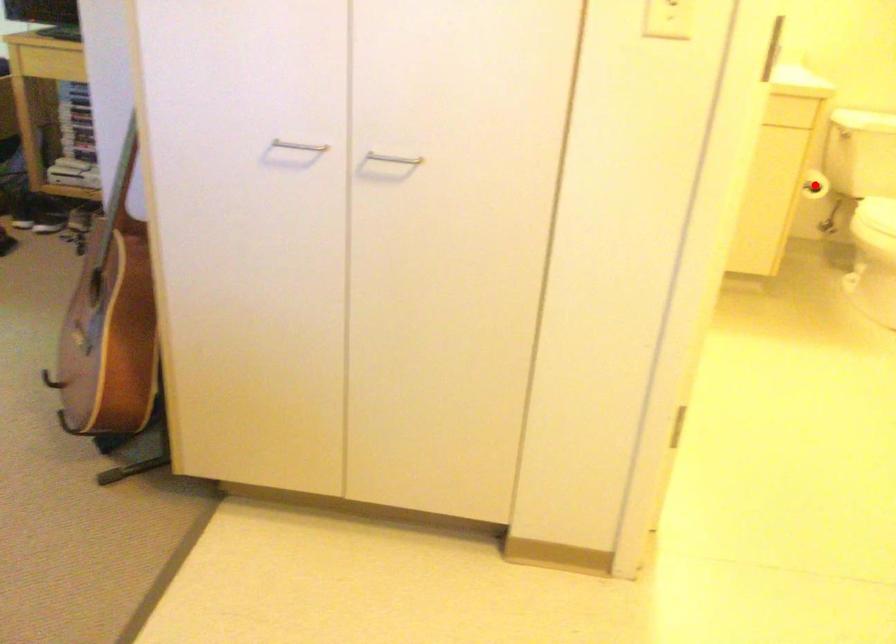
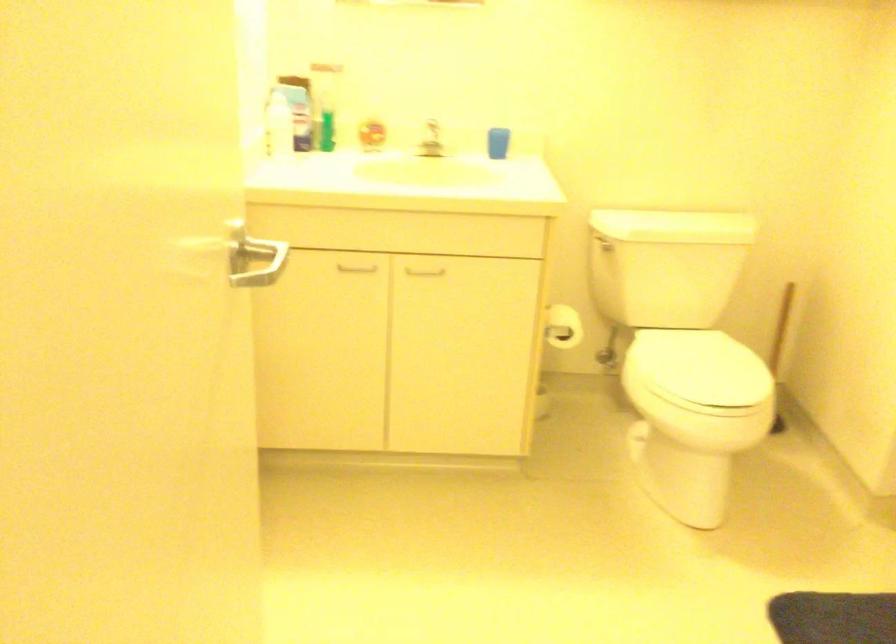
Question: I am providing you with two images of the same scene from different viewpoints. A red point is marked on the first image. At the location where the point appears in image 1, is it still visible in image 2?

Choices:
 (A) Yes
 (B) No

Answer: (B)